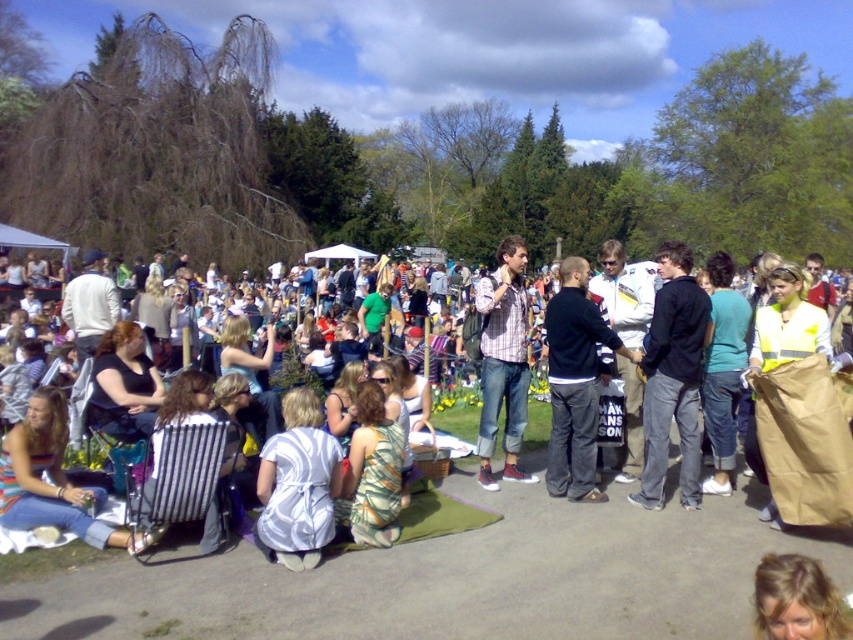
Question: In this image, where is dark gray sweater at center located relative to plaid shirt at center?

Choices:
 (A) right
 (B) left

Answer: (A)

Question: Considering the real-world distances, which object is closest to the dark gray sweater at center?

Choices:
 (A) black cotton jacket at center
 (B) plaid shirt at center

Answer: (A)

Question: Which object is the farthest from the dark gray sweater at center?

Choices:
 (A) black cotton jacket at center
 (B) plaid shirt at center

Answer: (B)

Question: Does black cotton jacket at center have a lesser width compared to plaid shirt at center?

Choices:
 (A) no
 (B) yes

Answer: (A)

Question: Is black cotton jacket at center bigger than dark gray sweater at center?

Choices:
 (A) yes
 (B) no

Answer: (A)

Question: Which object is closer to the camera taking this photo?

Choices:
 (A) dark gray sweater at center
 (B) black cotton jacket at center
 (C) plaid shirt at center

Answer: (B)